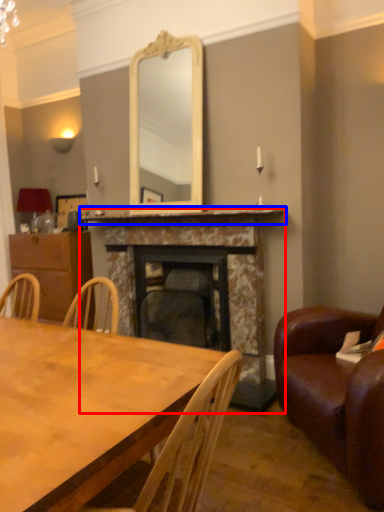
Question: Which object is further to the camera taking this photo, fireplace (highlighted by a red box) or mantle (highlighted by a blue box)?

Choices:
 (A) fireplace
 (B) mantle

Answer: (A)